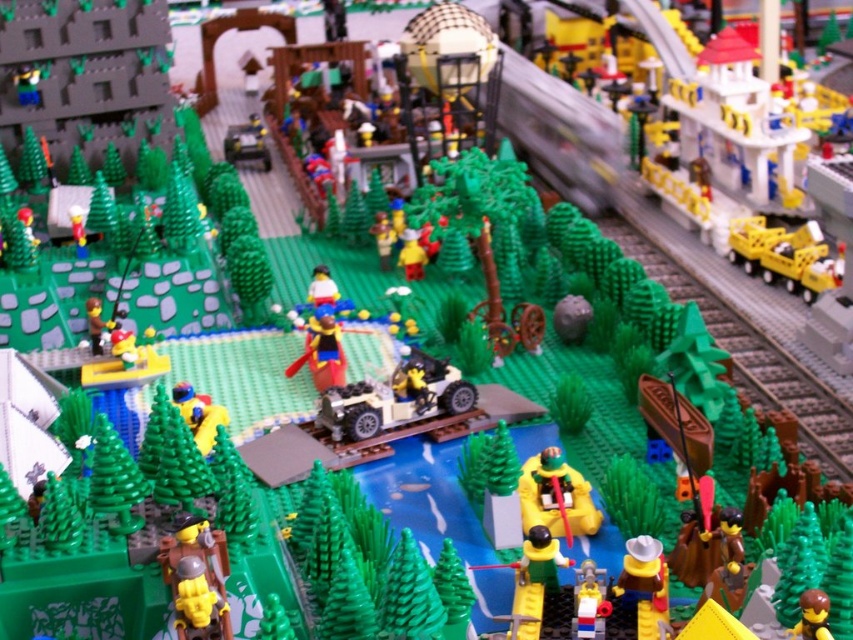
Question: Does yellow matte boat at center lie behind smooth plastic figure at lower center?

Choices:
 (A) yes
 (B) no

Answer: (A)

Question: Based on their relative distances, which object is farther from the smooth yellow boat at center?

Choices:
 (A) matte yellow cowboy hat at lower right
 (B) smooth plastic figure at lower center

Answer: (A)

Question: Can you confirm if yellow matte boat at center is positioned below matte yellow cowboy hat at lower right?

Choices:
 (A) yes
 (B) no

Answer: (B)

Question: Is yellow matte boat at center wider than smooth yellow boat at center?

Choices:
 (A) yes
 (B) no

Answer: (A)

Question: Which point is closer to the camera?

Choices:
 (A) (579, 602)
 (B) (523, 528)

Answer: (A)

Question: Which of these objects is positioned closest to the smooth yellow boat at center?

Choices:
 (A) matte yellow cowboy hat at lower right
 (B) yellow matte boat at center
 (C) smooth plastic figure at lower center

Answer: (B)